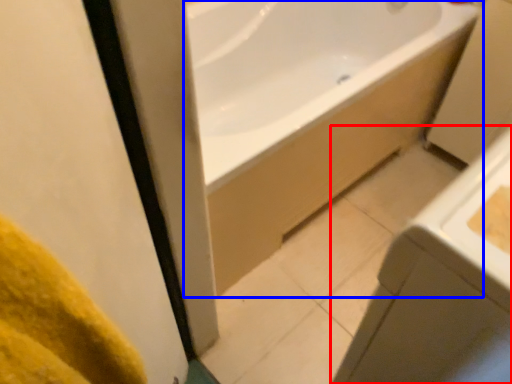
Question: Among these objects, which one is farthest to the camera, sink (highlighted by a red box) or bathtub (highlighted by a blue box)?

Choices:
 (A) sink
 (B) bathtub

Answer: (B)